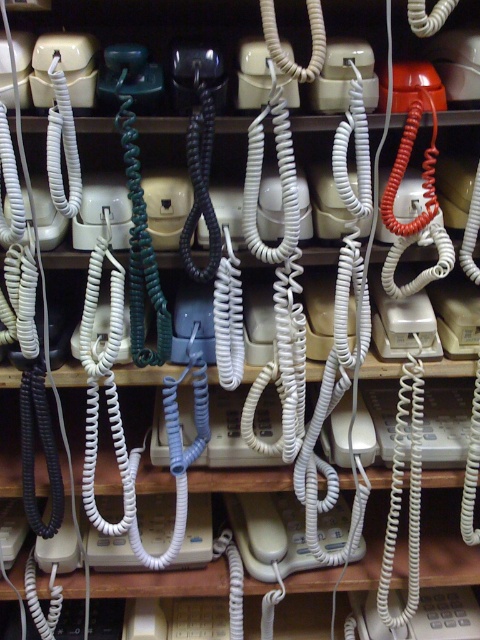
You are standing in front of the vintage telephone display. The white matte phone at center is located at coordinates point 0.834, 0.562. If you want to reach it, which direction should you move relative to your current position?

The white matte phone at center is located at coordinates point (269, 532). Since the coordinates are given as x,y values between 0 and 1, moving towards higher x values means moving to the right and higher y values mean moving forward. To reach the white matte phone at center, you should move diagonally to the right and forward.

You are a photographer standing in front of the vintage telephone display. You want to capture a photo that includes both the point at coordinates point (x=238, y=493) and point (x=466, y=616). Which point is closer to your camera lens?

Point (x=238, y=493) is further to the camera than point (x=466, y=616), so the point closer to the camera lens is point (x=466, y=616).